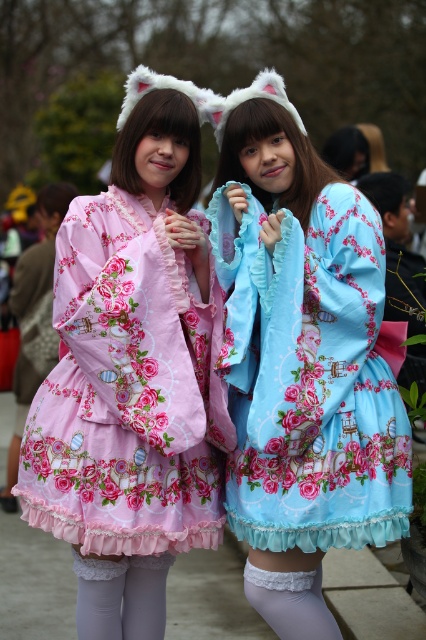
You are a photographer standing at the camera position. You want to adjust your lens to focus on the pink floral fabric dress at center. The dress is 12.65 feet away from you. Your camera has a focal length of 50mm. What is the hyperfocal distance required to ensure the dress is in sharp focus?

The hyperfocal distance required to ensure the pink floral fabric dress at center is in sharp focus when it is 12.65 feet away would depend on the aperture setting and sensor size of the camera. However, since the dress is positioned at 12.65 feet from the camera, focusing at this distance should place it within the acceptable sharpness range for most standard photography scenarios.

You are a photographer setting up a photo shoot. You have a pink floral fabric dress at center and white lace tights at lower center in the scene. Which object is positioned higher in the image?

The pink floral fabric dress at center is much taller than the white lace tights at lower center, so it is positioned higher in the image.

You are a photographer setting up a shoot and need to position a light source to the right of the light gray tights at lower center. Which object should you place the light to the right of to ensure it illuminates the pink floral fabric dress at center properly?

The light gray tights at lower center are to the right of the pink floral fabric dress at center. To position the light to the right of the light gray tights at lower center, you should place it further to the right side of the light gray tights at lower center, ensuring it can still illuminate the pink floral fabric dress at center which is located to the left of the light gray tights at lower center.